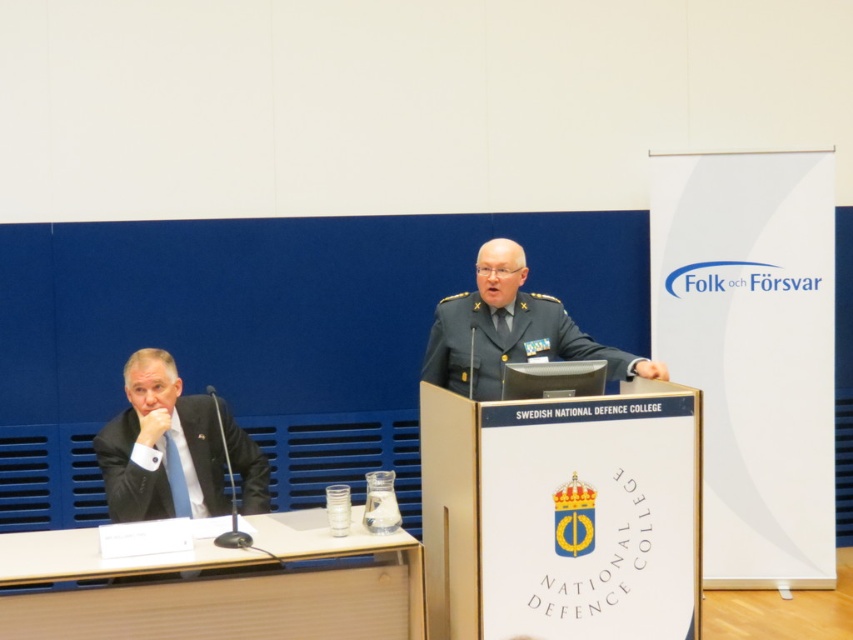
Question: Does light brown wood table at lower left appear over uniformed military officer at center?

Choices:
 (A) no
 (B) yes

Answer: (A)

Question: From the image, what is the correct spatial relationship of black suit at left in relation to uniformed military officer at center?

Choices:
 (A) left
 (B) right

Answer: (A)

Question: Estimate the real-world distances between objects in this image. Which object is farther from the light brown wood table at lower left?

Choices:
 (A) black suit at left
 (B) uniformed military officer at center

Answer: (B)

Question: Based on their relative distances, which object is farther from the uniformed military officer at center?

Choices:
 (A) light brown wood table at lower left
 (B) black suit at left

Answer: (B)

Question: Which point is closer to the camera?

Choices:
 (A) (236, 595)
 (B) (196, 394)
 (C) (525, 324)

Answer: (A)

Question: Is light brown wood table at lower left closer to the viewer compared to black suit at left?

Choices:
 (A) yes
 (B) no

Answer: (A)